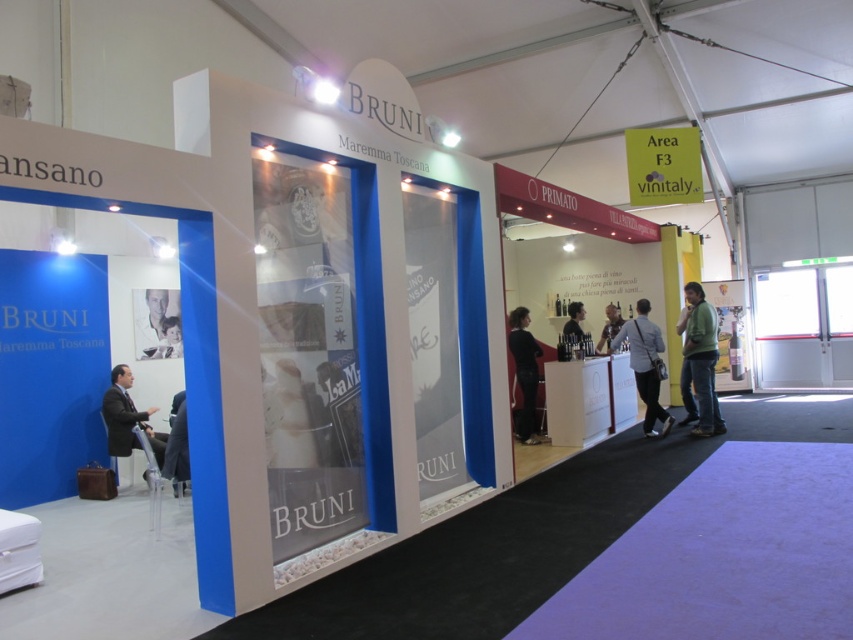
Does light brown leather jacket at lower left have a greater height compared to light brown leather jacket at center?

No.

Locate an element on the screen. This screenshot has width=853, height=640. light brown leather jacket at lower left is located at coordinates (166, 339).

Can you confirm if green matte jacket at lower right is bigger than light brown leather jacket at lower left?

Indeed, green matte jacket at lower right has a larger size compared to light brown leather jacket at lower left.

Between green matte jacket at lower right and light brown leather jacket at lower left, which one is positioned lower?

green matte jacket at lower right is lower down.

Measure the distance between green matte jacket at lower right and camera.

A distance of 7.29 meters exists between green matte jacket at lower right and camera.

This screenshot has height=640, width=853. I want to click on green matte jacket at lower right, so click(701, 358).

Between light brown leather jacket at center and matte black jacket at center, which one is positioned higher?

matte black jacket at center

Measure the distance between point (614, 314) and camera.

They are 9.10 meters apart.

Where is `light brown leather jacket at center`? light brown leather jacket at center is located at coordinates (608, 326).